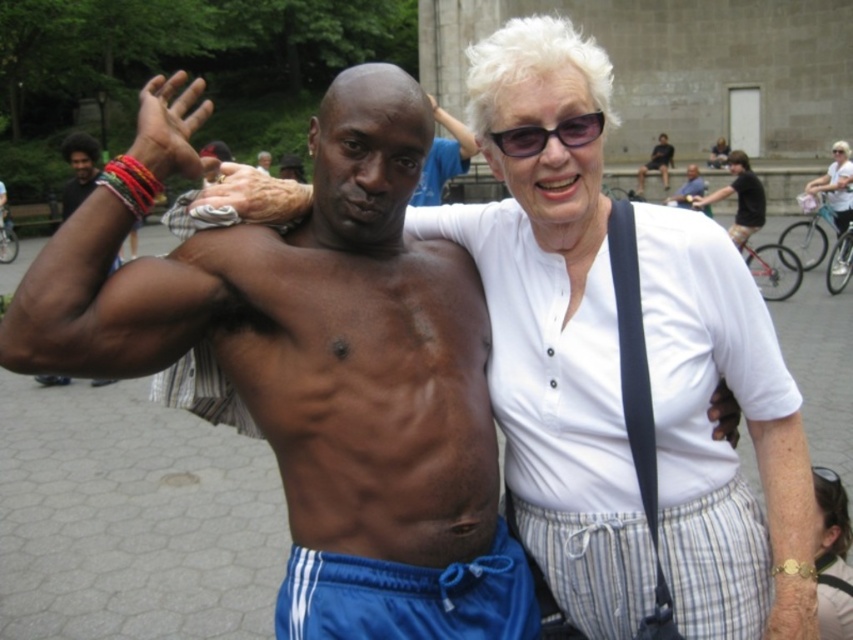
From the picture: Between blue fabric shorts at lower center and dark brown skin at center, which one is positioned lower?

blue fabric shorts at lower center is below.

Describe the element at coordinates (407, 596) in the screenshot. I see `blue fabric shorts at lower center` at that location.

Is point (389, 566) closer to viewer compared to point (729, 188)?

Yes, point (389, 566) is in front of point (729, 188).

The height and width of the screenshot is (640, 853). Find the location of `blue fabric shorts at lower center`. blue fabric shorts at lower center is located at coordinates (407, 596).

Which of these two, smooth skin torso at center or dark brown skin at center, stands taller?

smooth skin torso at center

What do you see at coordinates (444, 157) in the screenshot? The width and height of the screenshot is (853, 640). I see `smooth skin torso at center` at bounding box center [444, 157].

What are the coordinates of `smooth skin torso at center` in the screenshot? It's located at (444, 157).

The height and width of the screenshot is (640, 853). What do you see at coordinates (407, 596) in the screenshot?
I see `blue fabric shorts at lower center` at bounding box center [407, 596].

Is the position of blue fabric shorts at lower center more distant than that of smooth skin torso at center?

No.

Locate an element on the screen. This screenshot has width=853, height=640. blue fabric shorts at lower center is located at coordinates (407, 596).